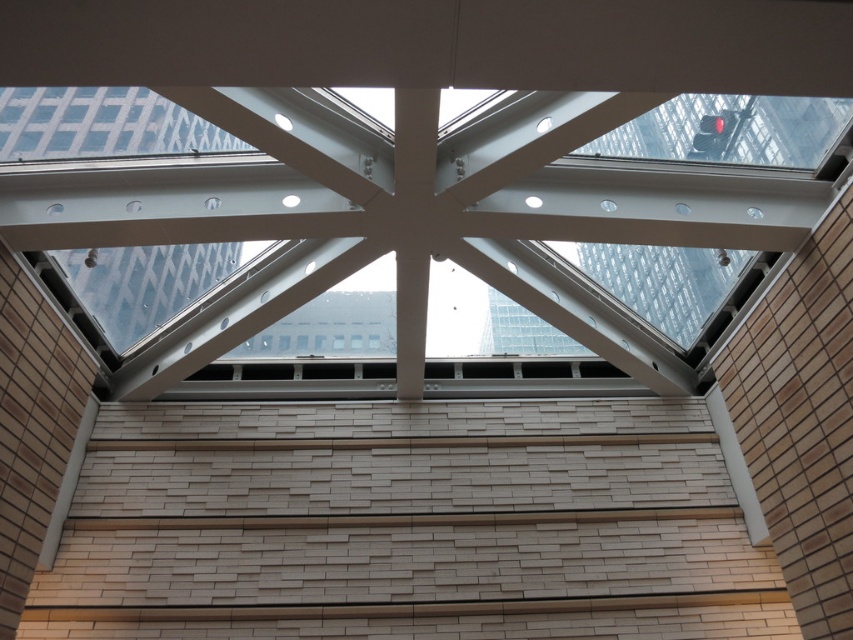
You are an architect designing a new building and want to ensure proper lighting. The white glass window at center and transparent glass window at upper left are both important for natural light. Which window allows more light into the space based on their sizes?

The white glass window at center has a greater height compared to the transparent glass window at upper left, so it allows more light into the space due to its larger size.

You are an architect designing a new office space and need to place a large potted plant between the white glass window at center and the transparent glass window at upper left. Based on their positions, which window should the plant be closer to?

The white glass window at center is to the right of the transparent glass window at upper left, so the plant should be placed closer to the transparent glass window at upper left to maintain symmetry between the two windows.

You are standing in the modern interior space with the skylight above. You notice two points marked on the wall. The first point is at coordinate point (596, 208) and the second is at point (61, 136). If you want to touch both points starting from the nearest one, which point should you reach for first?

You should reach for point (61, 136) first because it is closer to you than point (596, 208), which is further away.